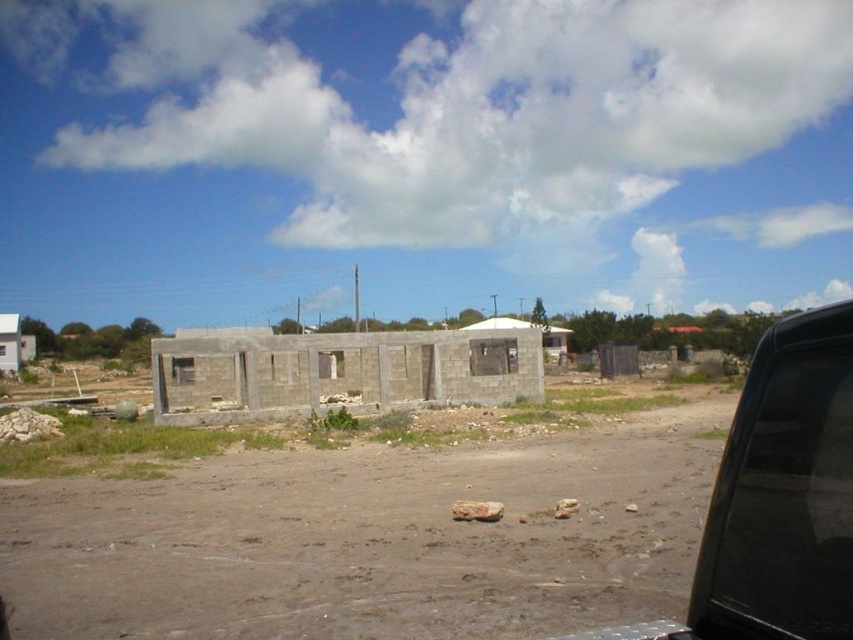
What do you see at coordinates (778, 497) in the screenshot? I see `black matte car at right` at bounding box center [778, 497].

Does black matte car at right appear on the left side of gray concrete hut at center?

Incorrect, black matte car at right is not on the left side of gray concrete hut at center.

I want to click on black matte car at right, so click(778, 497).

Does gray concrete wall at center have a lesser height compared to white concrete hut at lower left?

Yes.

The height and width of the screenshot is (640, 853). Describe the element at coordinates (338, 371) in the screenshot. I see `gray concrete wall at center` at that location.

Identify the location of gray concrete wall at center. (338, 371).

Where is `gray concrete wall at center`? This screenshot has width=853, height=640. gray concrete wall at center is located at coordinates (338, 371).

Image resolution: width=853 pixels, height=640 pixels. Describe the element at coordinates (778, 497) in the screenshot. I see `black matte car at right` at that location.

Is black matte car at right below gray concrete wall at center?

Correct, black matte car at right is located below gray concrete wall at center.

Find the location of a particular element. The height and width of the screenshot is (640, 853). black matte car at right is located at coordinates (778, 497).